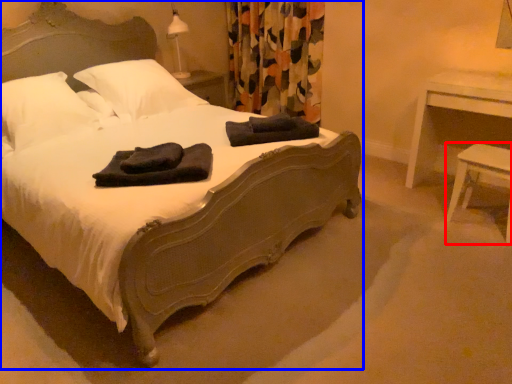
Question: Which object appears closest to the camera in this image, stool (highlighted by a red box) or bed (highlighted by a blue box)?

Choices:
 (A) stool
 (B) bed

Answer: (B)